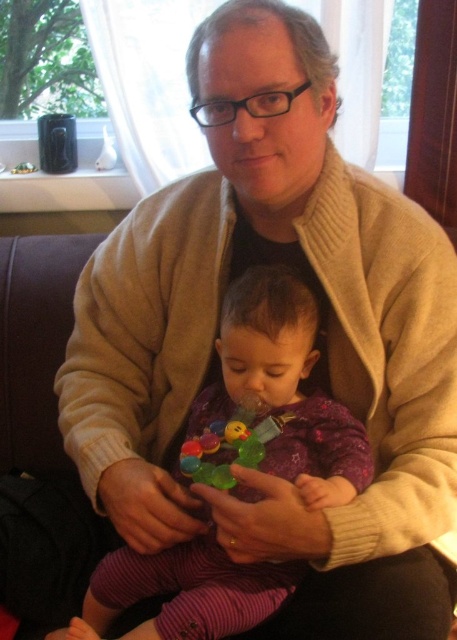
Is point (261, 362) farther from camera compared to point (222, 465)?

That is False.

Who is higher up, purple fleece baby at center or translucent plastic toy at center?

translucent plastic toy at center is higher up.

Between point (223, 582) and point (232, 435), which one is positioned behind?

Point (232, 435)

Find the location of a particular element. This screenshot has width=457, height=640. purple fleece baby at center is located at coordinates (283, 388).

Who is shorter, purple fleece baby at center or rubber teething ring at center?

Standing shorter between the two is rubber teething ring at center.

This screenshot has width=457, height=640. Describe the element at coordinates (283, 388) in the screenshot. I see `purple fleece baby at center` at that location.

Image resolution: width=457 pixels, height=640 pixels. Identify the location of purple fleece baby at center. (283, 388).

Who is positioned more to the right, translucent plastic toy at center or rubber teething ring at center?

translucent plastic toy at center

Describe the element at coordinates (228, 445) in the screenshot. The height and width of the screenshot is (640, 457). I see `translucent plastic toy at center` at that location.

Image resolution: width=457 pixels, height=640 pixels. Identify the location of translucent plastic toy at center. (228, 445).